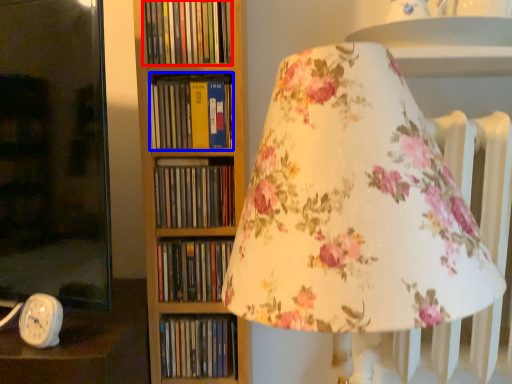
Question: Among these objects, which one is farthest to the camera, book (highlighted by a red box) or book (highlighted by a blue box)?

Choices:
 (A) book
 (B) book

Answer: (B)